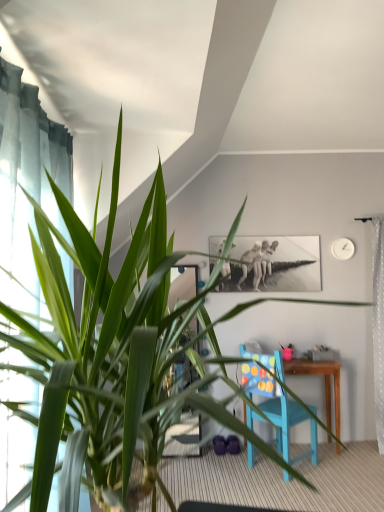
The height and width of the screenshot is (512, 384). I want to click on free space that is to the left of matte blue chair at center, so click(230, 471).